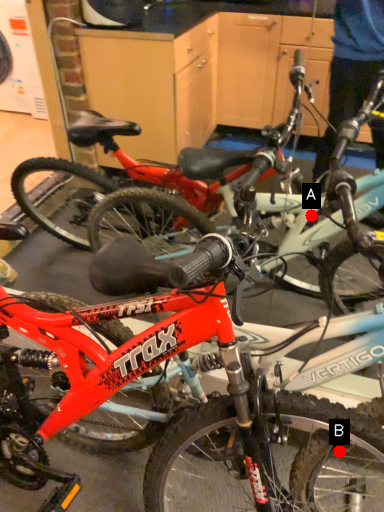
Question: Two points are circled on the image, labeled by A and B beside each circle. Among these points, which one is farthest from the camera?

Choices:
 (A) A is further
 (B) B is further

Answer: (A)